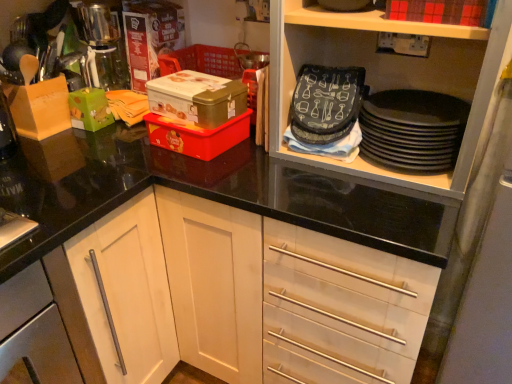
Find the location of a particular element. Image resolution: width=512 pixels, height=384 pixels. empty space that is ontop of metallic gold box at center, which is the third box in right-to-left order (from a real-world perspective) is located at coordinates (194, 86).